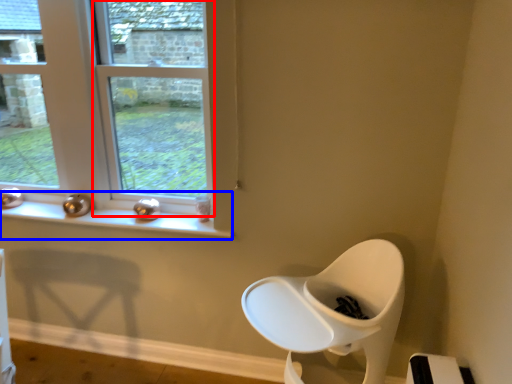
Question: Which point is closer to the camera, window (highlighted by a red box) or window sill (highlighted by a blue box)?

Choices:
 (A) window
 (B) window sill

Answer: (A)